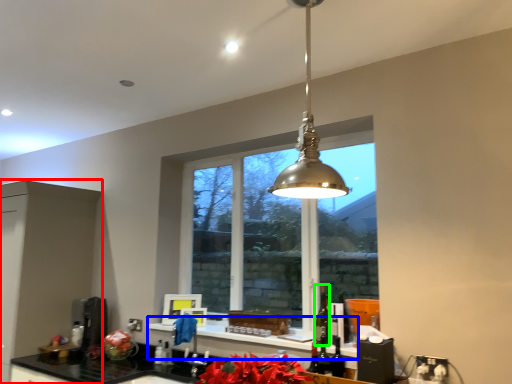
Question: Based on their relative distances, which object is farther from cabinetry (highlighted by a red box)? Choose from window sill (highlighted by a blue box) and alcohol (highlighted by a green box).

Choices:
 (A) window sill
 (B) alcohol

Answer: (B)